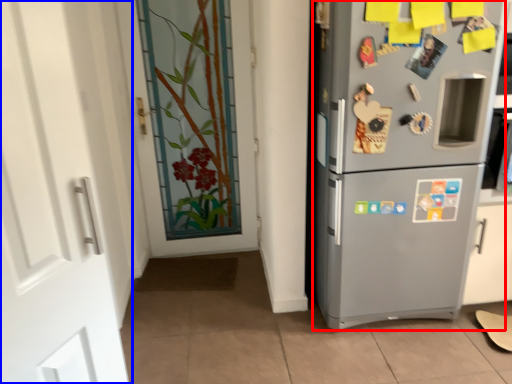
Question: Which object appears closest to the camera in this image, refrigerator (highlighted by a red box) or door (highlighted by a blue box)?

Choices:
 (A) refrigerator
 (B) door

Answer: (B)